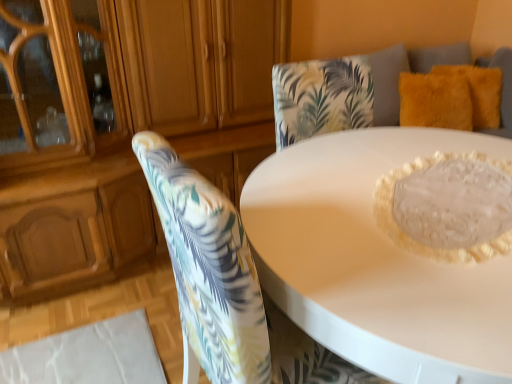
Where is `free location to the left of translucent glass cake at center`? This screenshot has width=512, height=384. free location to the left of translucent glass cake at center is located at coordinates [313, 202].